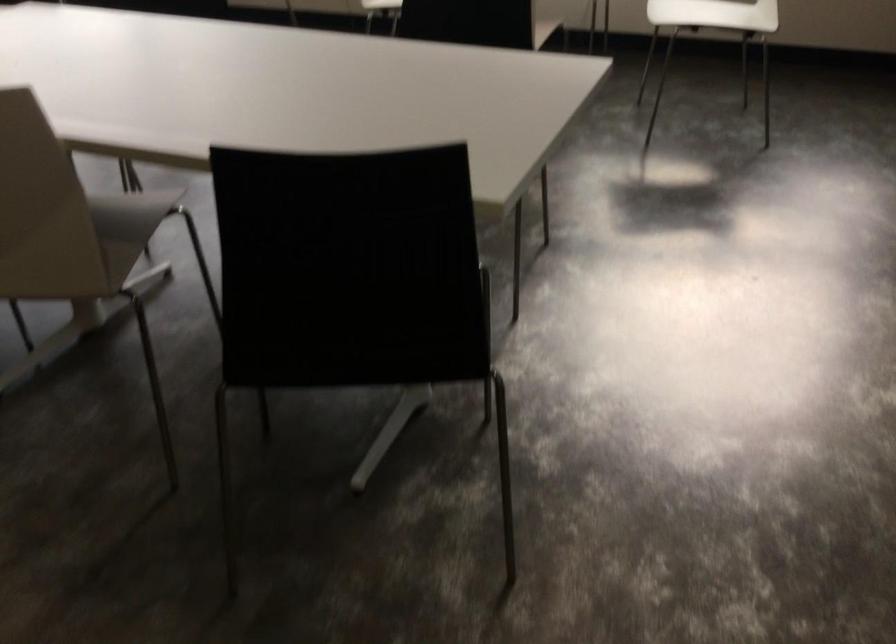
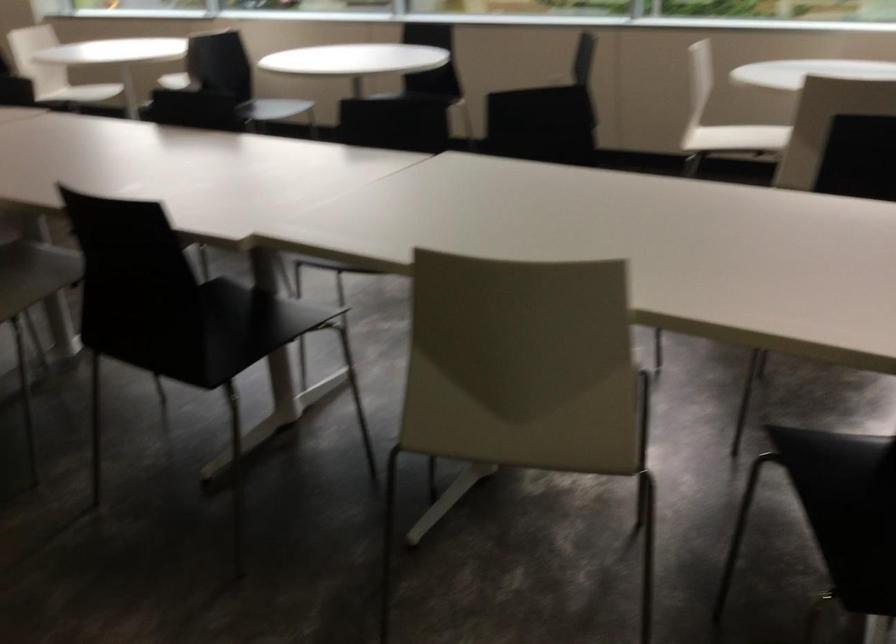
Question: How did the camera likely rotate?

Choices:
 (A) Left
 (B) Right
 (C) Up
 (D) Down

Answer: (A)